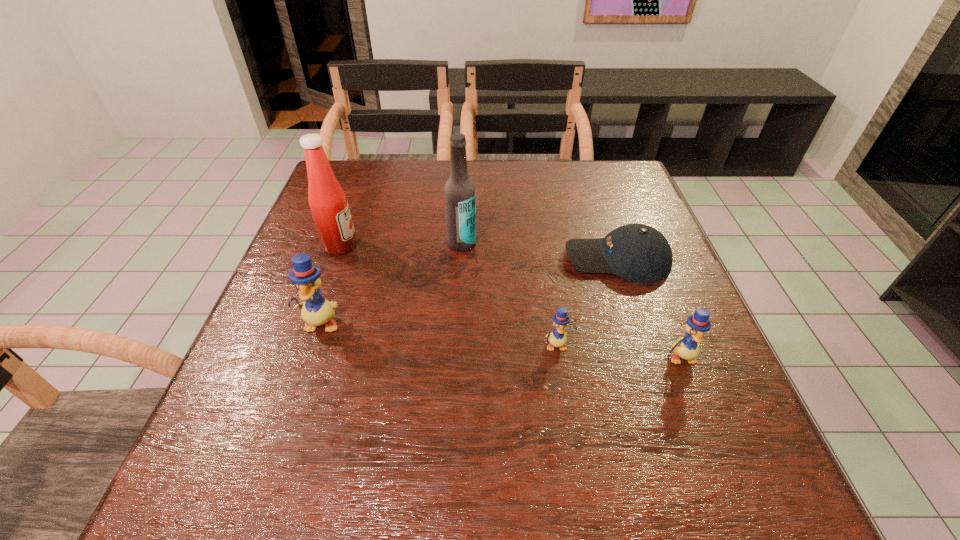
Where is `free space that satisfies the following two spatial constraints: 1. on the label of the third object from left to right; 2. on the front-facing side of the condiment`? This screenshot has height=540, width=960. free space that satisfies the following two spatial constraints: 1. on the label of the third object from left to right; 2. on the front-facing side of the condiment is located at coordinates (462, 246).

Where is `free space that satisfies the following two spatial constraints: 1. on the front-facing side of the baseball cap; 2. on the face of the leftmost duckling, where the monocle is placed`? This screenshot has height=540, width=960. free space that satisfies the following two spatial constraints: 1. on the front-facing side of the baseball cap; 2. on the face of the leftmost duckling, where the monocle is placed is located at coordinates (638, 323).

In order to click on free location that satisfies the following two spatial constraints: 1. on the label of the beer bottle; 2. on the front-facing side of the condiment in this screenshot , I will do `click(462, 246)`.